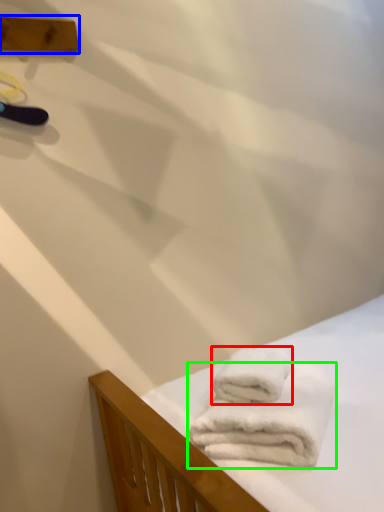
Question: Which is farther away from towel (highlighted by a red box)? plank (highlighted by a blue box) or towel (highlighted by a green box)?

Choices:
 (A) plank
 (B) towel

Answer: (A)